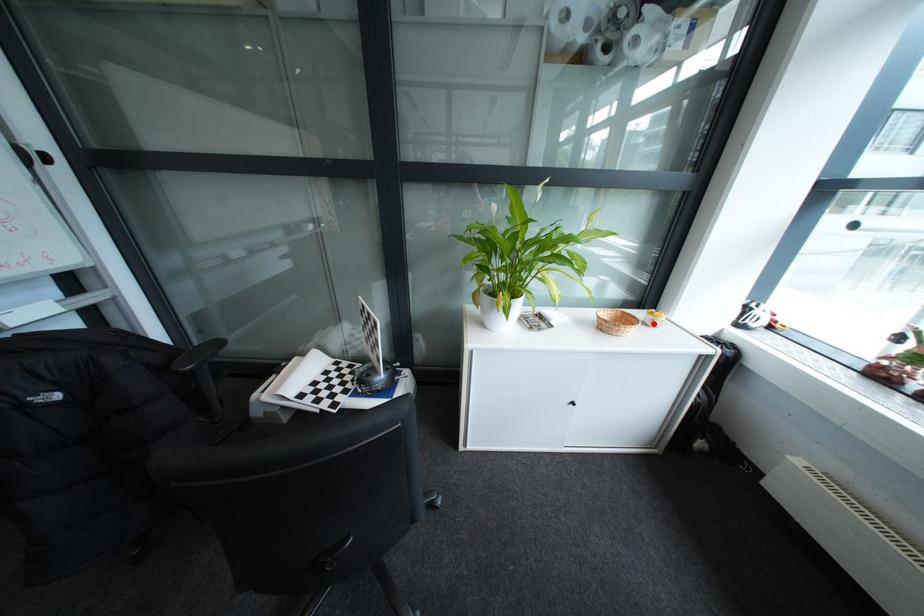
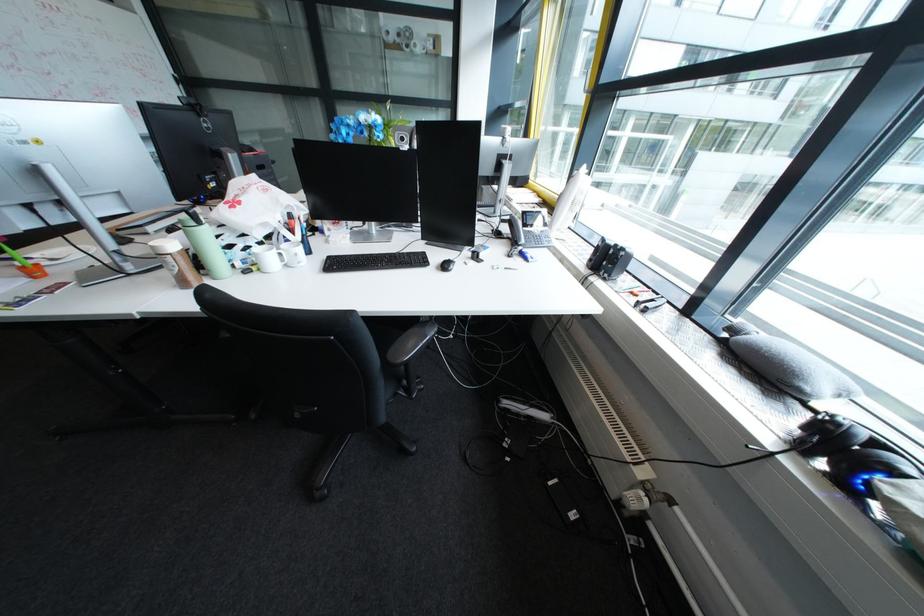
Question: I am providing you with two images of the same scene from different viewpoints. A red point is marked on the first image. Is the red point's position out of view in image 2?

Choices:
 (A) Yes
 (B) No

Answer: (A)